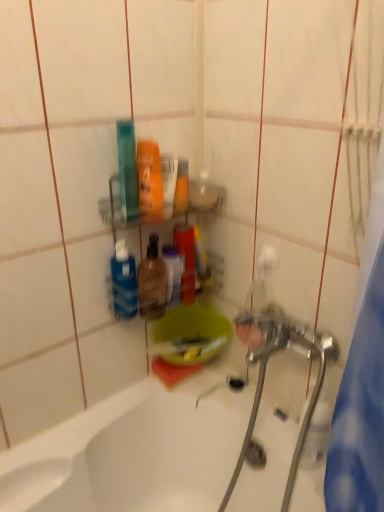
Question: From the image's perspective, is translucent plastic bottle at center positioned above or below metallic silver water pipe at lower right?

Choices:
 (A) below
 (B) above

Answer: (B)

Question: Considering their positions, is translucent plastic bottle at center located in front of or behind metallic silver water pipe at lower right?

Choices:
 (A) behind
 (B) front

Answer: (A)

Question: Considering the real-world distances, which object is farthest from the chrome metallic faucet at center?

Choices:
 (A) translucent plastic bottle at center
 (B) metallic silver water pipe at lower right
 (C) blue matte bottle at center
 (D) white glossy bathtub at lower left

Answer: (C)

Question: Which of these objects is positioned farthest from the translucent plastic bottle at center?

Choices:
 (A) blue matte bottle at center
 (B) metallic silver water pipe at lower right
 (C) chrome metallic faucet at center
 (D) white glossy bathtub at lower left

Answer: (B)